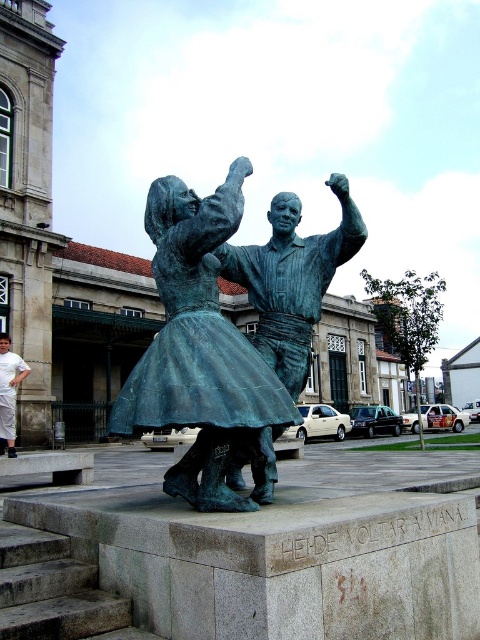
Question: Which object is the farthest from the bronze statue at center?

Choices:
 (A) white cotton pants at lower left
 (B) gray stone stairs at lower left

Answer: (A)

Question: Does bronze statue at center come behind white cotton pants at lower left?

Choices:
 (A) no
 (B) yes

Answer: (A)

Question: Which point is closer to the camera?

Choices:
 (A) (232, 403)
 (B) (46, 625)
 (C) (28, 371)

Answer: (B)

Question: Which object is positioned farthest from the bronze statue at center?

Choices:
 (A) white cotton pants at lower left
 (B) gray stone stairs at lower left

Answer: (A)

Question: Is gray stone stairs at lower left above white cotton pants at lower left?

Choices:
 (A) yes
 (B) no

Answer: (B)

Question: Does bronze statue at center appear on the right side of gray stone stairs at lower left?

Choices:
 (A) yes
 (B) no

Answer: (B)